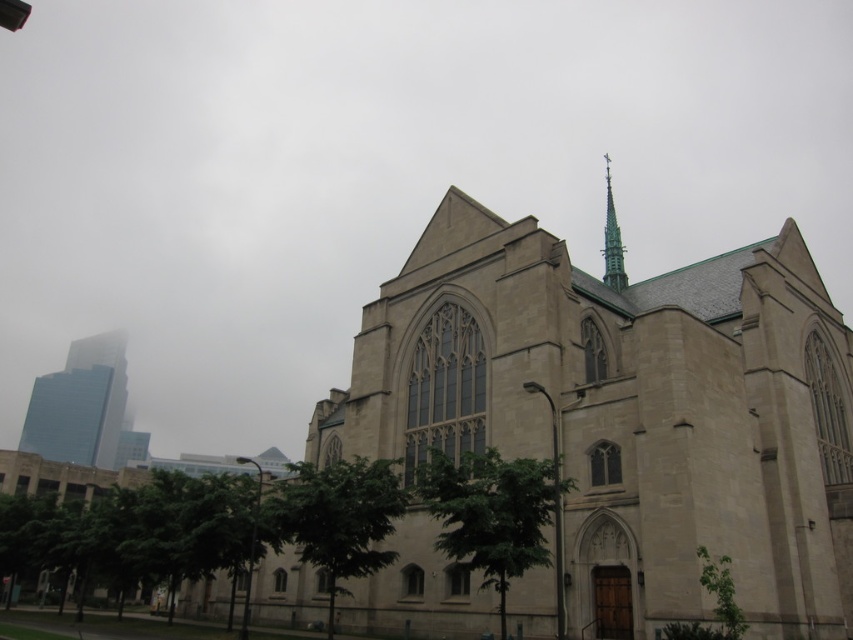
Question: Can you confirm if green leafy tree at lower right is positioned to the left of green stone spire at upper center?

Choices:
 (A) no
 (B) yes

Answer: (B)

Question: Which point is closer to the camera taking this photo?

Choices:
 (A) (676, 632)
 (B) (112, 346)
 (C) (612, 243)

Answer: (A)

Question: Which of the following is the farthest from the observer?

Choices:
 (A) (90, 340)
 (B) (666, 621)

Answer: (A)

Question: Does beige stone church at center have a greater width compared to green stone spire at upper center?

Choices:
 (A) yes
 (B) no

Answer: (A)

Question: Based on their relative distances, which object is nearer to the green leafy tree at center?

Choices:
 (A) green leafy tree at lower center
 (B) beige stone church at center
 (C) green leafy tree at lower right

Answer: (A)

Question: Does beige stone church at center have a larger size compared to green stone spire at upper center?

Choices:
 (A) no
 (B) yes

Answer: (B)